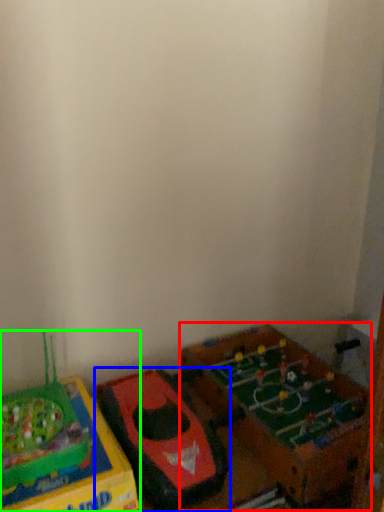
Question: Which object is positioned farthest from toy (highlighted by a red box)? Select from toy (highlighted by a blue box) and toy (highlighted by a green box).

Choices:
 (A) toy
 (B) toy

Answer: (B)